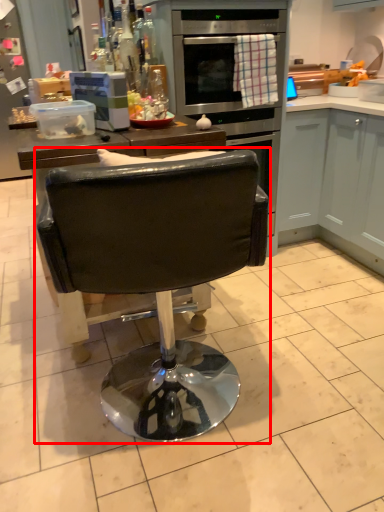
Question: From the image, what is the correct spatial relationship of chair (annotated by the red box) in relation to cabinetry?

Choices:
 (A) left
 (B) right

Answer: (A)